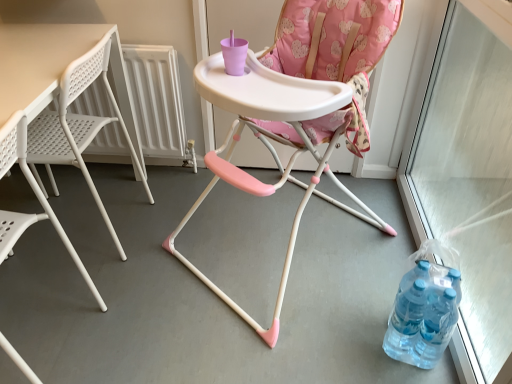
Find the location of a particular element. free space underneath white plastic radiator at left (from a real-world perspective) is located at coordinates click(x=125, y=168).